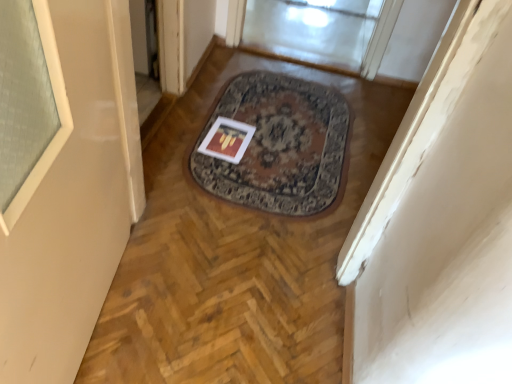
You are a GUI agent. You are given a task and a screenshot of the screen. Output one action in this format:
    pyautogui.click(x=<x>, y=<y>)
    Task: Click on the vacant space behind matte paper postcard at center
    This screenshot has height=384, width=512.
    Given the screenshot: What is the action you would take?
    pyautogui.click(x=238, y=111)